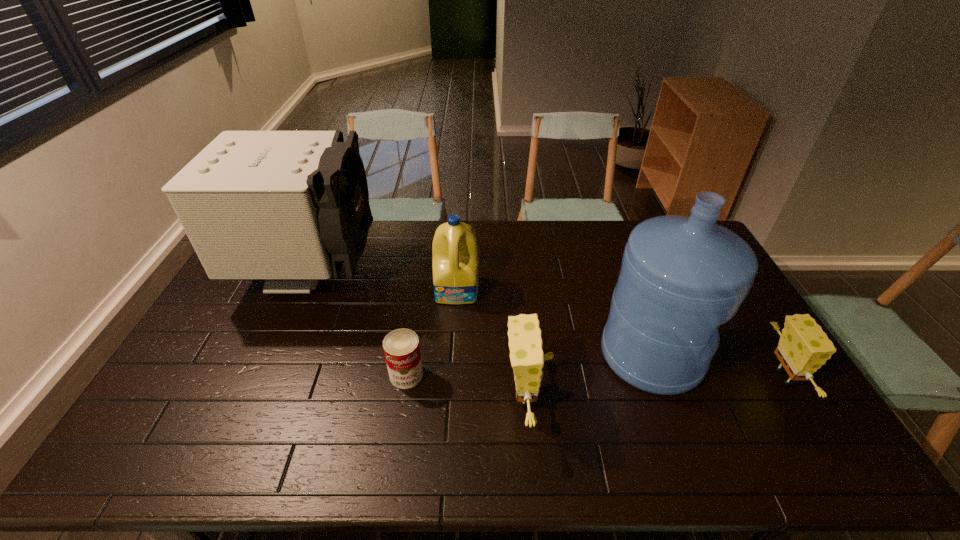
Where is `the fourth object from left to right`? the fourth object from left to right is located at coordinates (527, 359).

I want to click on the taller sponge, so click(527, 359).

Where is `the fifth tallest object`? The height and width of the screenshot is (540, 960). the fifth tallest object is located at coordinates pyautogui.click(x=804, y=347).

Identify the location of the right sponge. This screenshot has width=960, height=540. (804, 347).

Locate an element on the screen. the leftmost object is located at coordinates (291, 207).

At what (x,y) coordinates should I click in order to perform the action: click on the second object from right to left. Please return your answer as a coordinate pair (x, y). Looking at the image, I should click on (681, 277).

This screenshot has height=540, width=960. I want to click on the third tallest object, so click(455, 263).

Where is `detergent`? detergent is located at coordinates (455, 263).

You are a GUI agent. You are given a task and a screenshot of the screen. Output one action in this format:
    pyautogui.click(x=<x>, y=<y>)
    Task: Click on the can
    The height and width of the screenshot is (540, 960).
    Given the screenshot: What is the action you would take?
    [401, 347]

Identify the location of the second object from left to right. (401, 347).